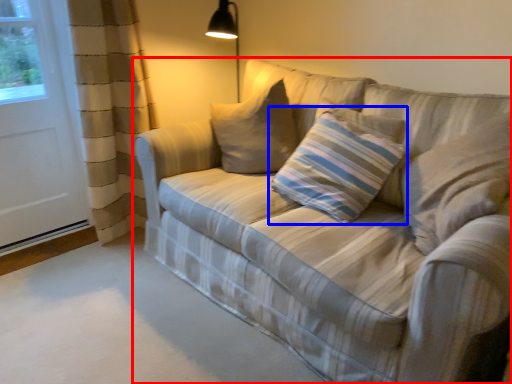
Question: Which of the following is the farthest to the observer, studio couch (highlighted by a red box) or pillow (highlighted by a blue box)?

Choices:
 (A) studio couch
 (B) pillow

Answer: (B)